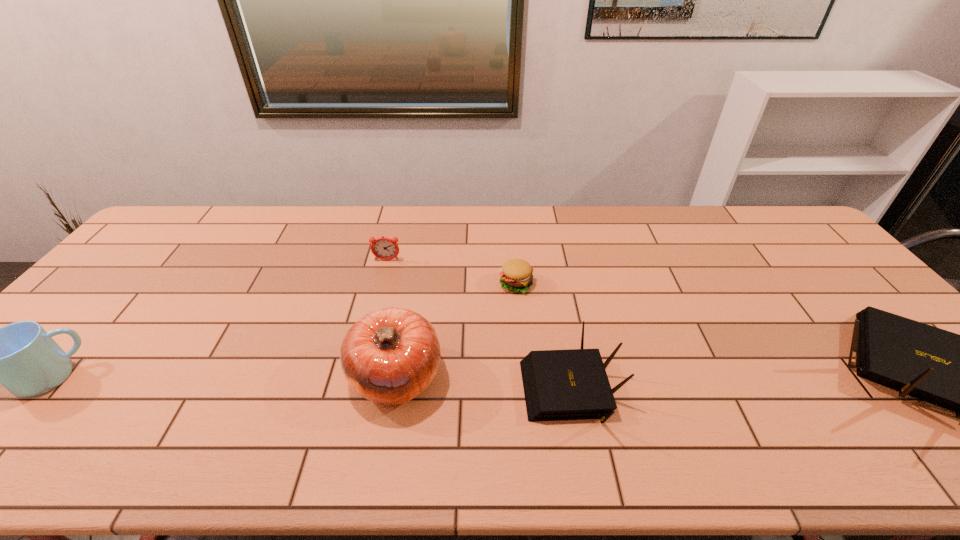
You are a GUI agent. You are given a task and a screenshot of the screen. Output one action in this format:
    pyautogui.click(x=<x>, y=<y>)
    Task: Click on the pumpkin at the near edge
    Image resolution: width=960 pixels, height=540 pixels.
    Given the screenshot: What is the action you would take?
    pyautogui.click(x=390, y=356)

Find the location of a particular element. The width and height of the screenshot is (960, 540). vacant space at the far edge of the desktop is located at coordinates (384, 220).

The width and height of the screenshot is (960, 540). I want to click on vacant space at the left edge, so click(115, 299).

You are a GUI agent. You are given a task and a screenshot of the screen. Output one action in this format:
    pyautogui.click(x=<x>, y=<y>)
    Task: Click on the free space at the right edge
    This screenshot has height=540, width=960.
    Given the screenshot: What is the action you would take?
    click(812, 258)

I want to click on vacant region at the near left corner of the desktop, so click(x=13, y=397).

Locate an element on the screen. The width and height of the screenshot is (960, 540). free space at the far right corner of the desktop is located at coordinates (757, 220).

Where is `vacant space in between the shortest object and the pumpkin`? This screenshot has height=540, width=960. vacant space in between the shortest object and the pumpkin is located at coordinates (456, 330).

I want to click on free spot between the left router and the second farthest object, so click(543, 336).

The image size is (960, 540). Find the location of `unoccupied position between the shortest object and the left router`. unoccupied position between the shortest object and the left router is located at coordinates (543, 336).

Identify which object is the second closest to the taller router. Please provide its 2D coordinates. Your answer should be formatted as a tuple, i.e. [(x, y)], where the tuple contains the x and y coordinates of a point satisfying the conditions above.

[(516, 275)]